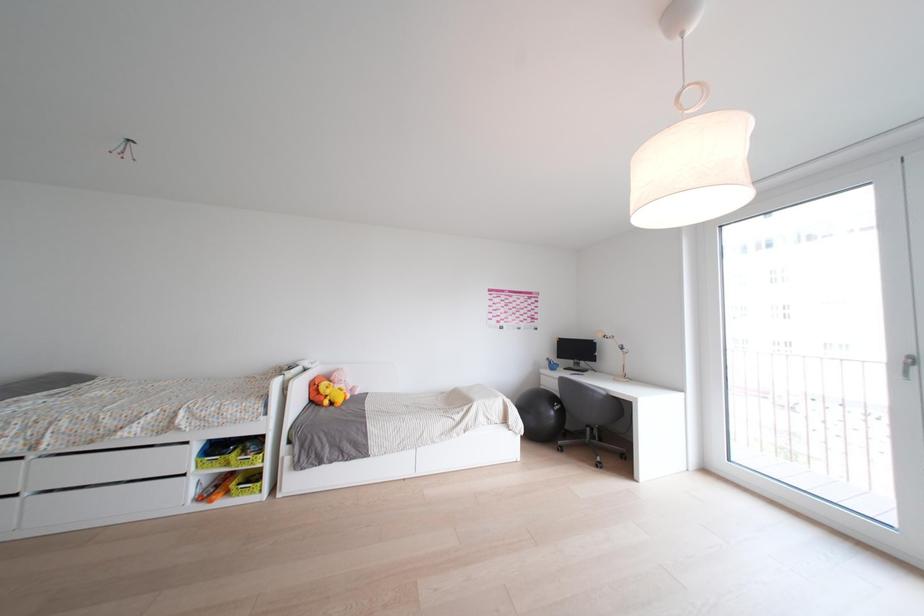
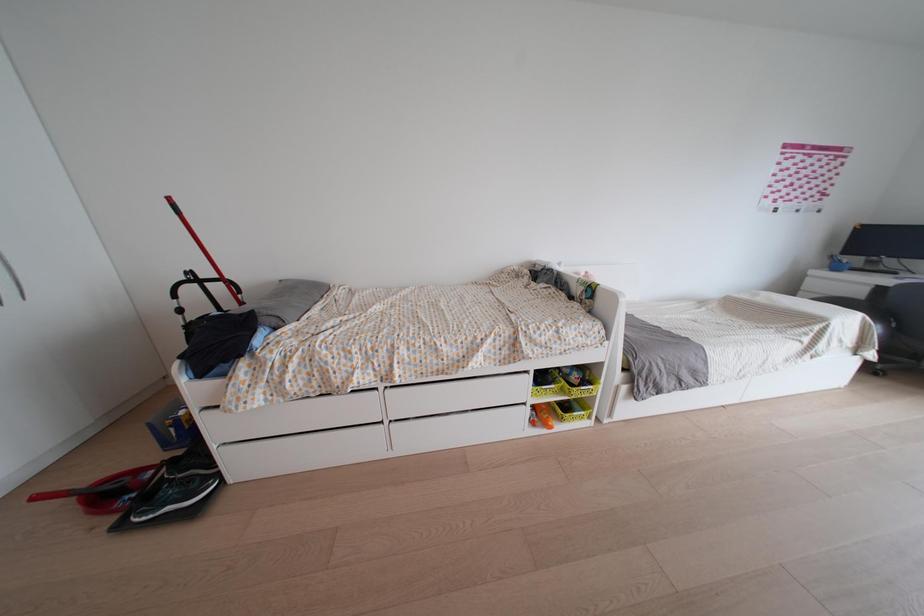
Question: Which direction would the cameraman need to move to produce the second image? Reply with the corresponding letter.

Choices:
 (A) Left
 (B) Right
 (C) Forward
 (D) Backward

Answer: (A)